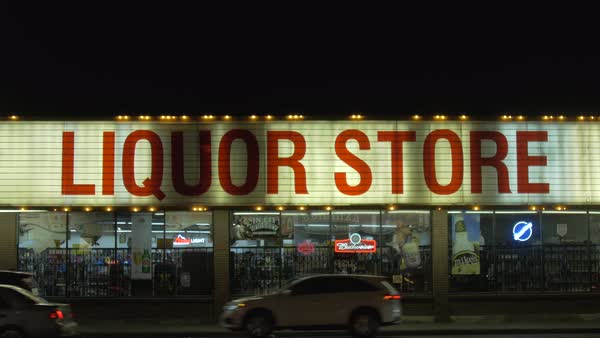
This screenshot has width=600, height=338. Find the location of `small yellow lights`. small yellow lights is located at coordinates (208, 115), (391, 207), (280, 207), (521, 117), (561, 208), (88, 208).